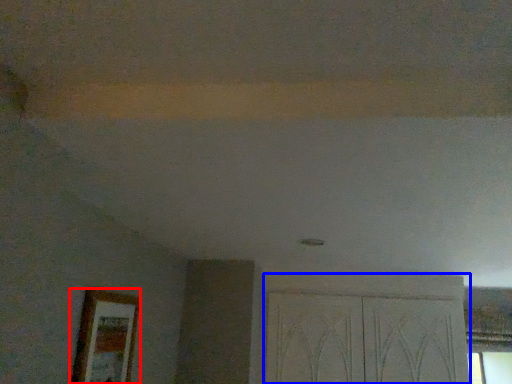
Question: Which object appears closest to the camera in this image, picture frame (highlighted by a red box) or screen door (highlighted by a blue box)?

Choices:
 (A) picture frame
 (B) screen door

Answer: (A)